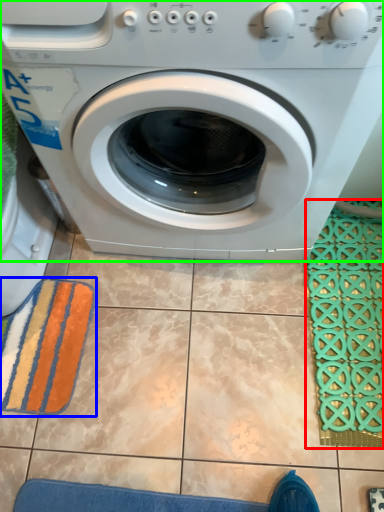
Question: Which object is the farthest from bath mat (highlighted by a red box)? Choose among these: bath towel (highlighted by a blue box) or washing machine (highlighted by a green box).

Choices:
 (A) bath towel
 (B) washing machine

Answer: (A)